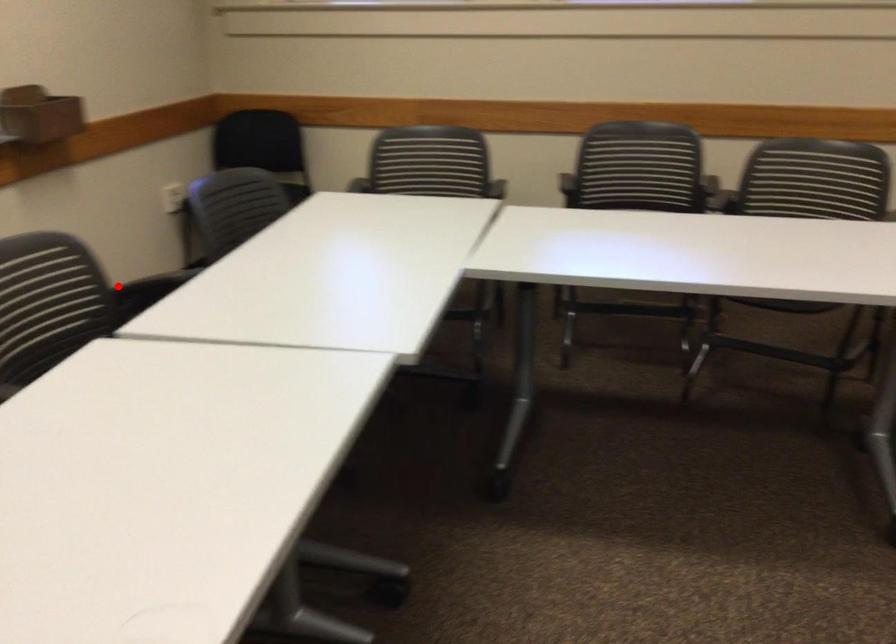
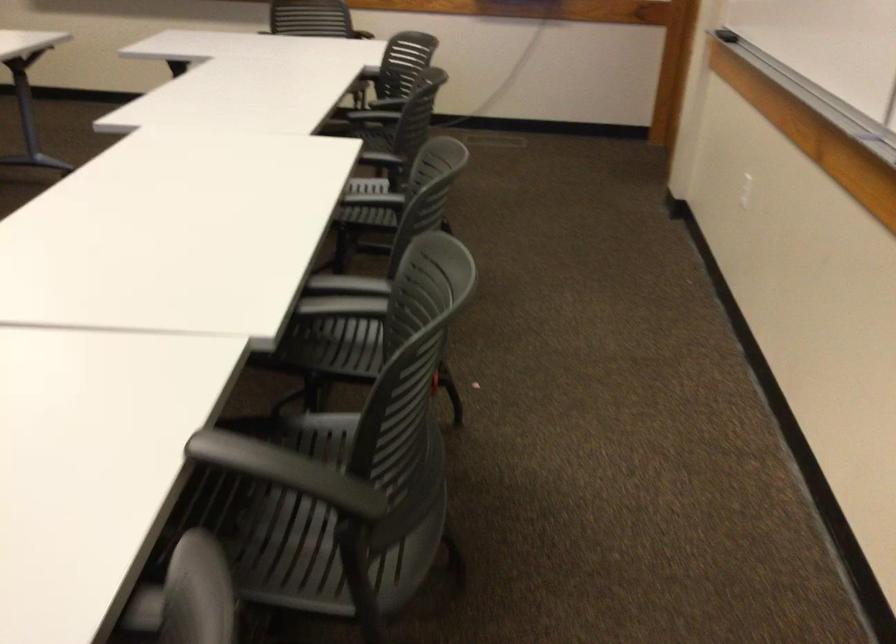
Find the pixel in the second image that matches the highlighted location in the first image.

(286, 471)